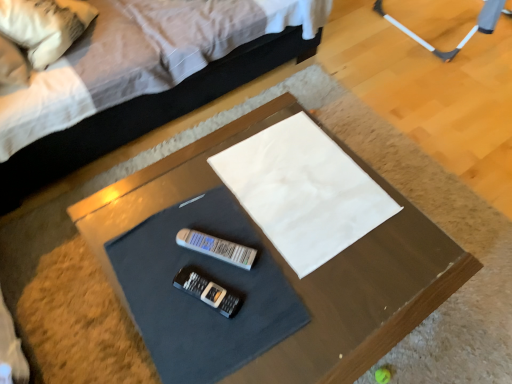
Question: Would you say white fabric pillow at upper left is inside or outside smooth brown table at center?

Choices:
 (A) outside
 (B) inside

Answer: (A)

Question: Visually, is white fabric pillow at upper left positioned to the left or to the right of smooth brown table at center?

Choices:
 (A) right
 (B) left

Answer: (B)

Question: Which object is positioned closest to the white fabric at center?

Choices:
 (A) white fabric bed at upper center
 (B) white fabric pillow at upper left
 (C) smooth brown table at center

Answer: (C)

Question: Which of these objects is positioned farthest from the white fabric at center?

Choices:
 (A) smooth brown table at center
 (B) white fabric bed at upper center
 (C) white fabric pillow at upper left

Answer: (C)